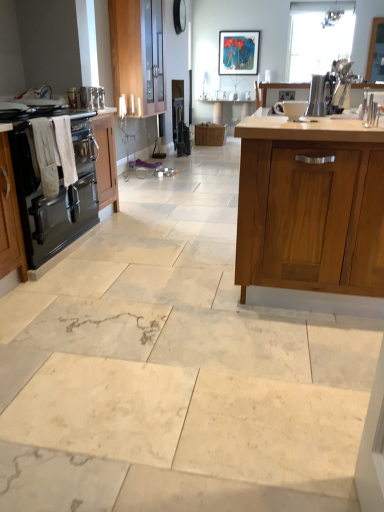
At what (x,y) coordinates should I click in order to perform the action: click on vacant space to the right of black glass stove at left, the third cabinetry positioned from the right. Please return your answer as a coordinate pair (x, y). The height and width of the screenshot is (512, 384). Looking at the image, I should click on (155, 254).